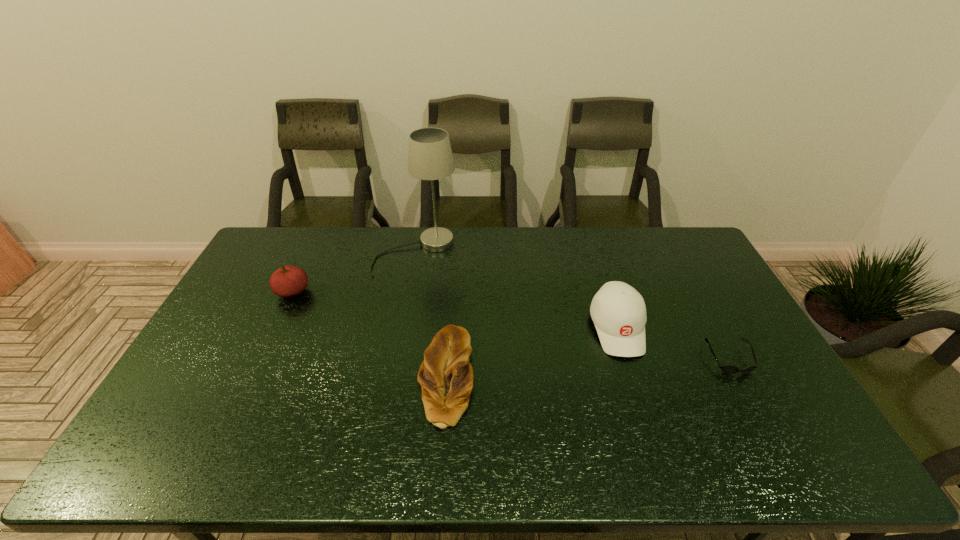
Locate an element on the screen. free space that is in between the fourth object from left to right and the shortest object is located at coordinates (673, 343).

At what (x,y) coordinates should I click in order to perform the action: click on free space that is in between the tomato and the tallest object. Please return your answer as a coordinate pair (x, y). This screenshot has height=540, width=960. Looking at the image, I should click on (354, 272).

Find the location of `blank region between the sunglasses and the leftmost object`. blank region between the sunglasses and the leftmost object is located at coordinates (511, 326).

Image resolution: width=960 pixels, height=540 pixels. I want to click on free space between the shortest object and the tomato, so click(x=511, y=326).

What are the coordinates of `free point between the tomato and the rightmost object` in the screenshot? It's located at (511, 326).

Locate an element on the screen. This screenshot has height=540, width=960. free spot between the shortest object and the farthest object is located at coordinates (573, 306).

This screenshot has width=960, height=540. I want to click on free area in between the leftmost object and the second shortest object, so click(370, 335).

Locate an element on the screen. free space between the rightmost object and the second object from right to left is located at coordinates (673, 343).

Find the location of a particular element. This screenshot has height=540, width=960. free space between the tomato and the baseball cap is located at coordinates (455, 310).

Locate an element on the screen. vacant area that lies between the farthest object and the leftmost object is located at coordinates (354, 272).